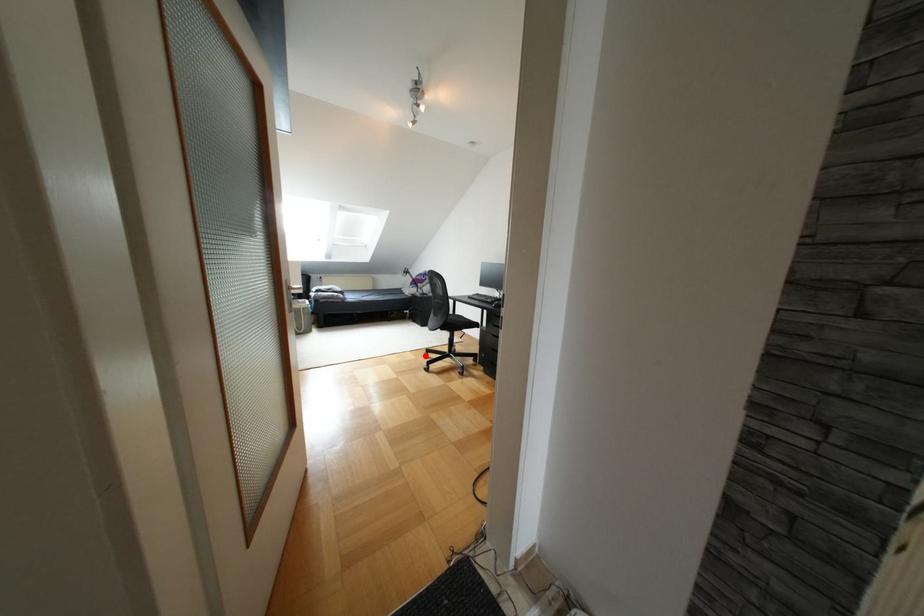
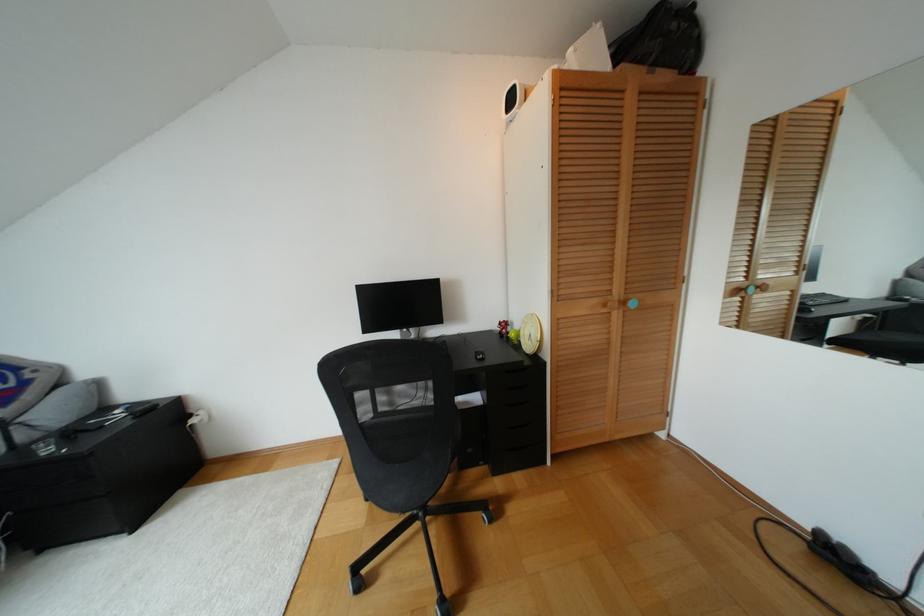
In the second image, find the point that corresponds to the highlighted location in the first image.

(359, 585)